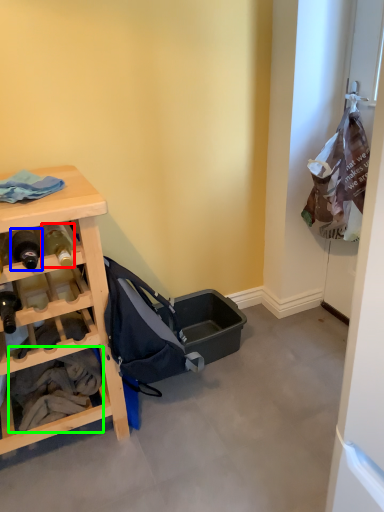
Question: Which object is the farthest from bottle (highlighted by a red box)? Choose among these: bottle (highlighted by a blue box) or clothing (highlighted by a green box).

Choices:
 (A) bottle
 (B) clothing

Answer: (B)